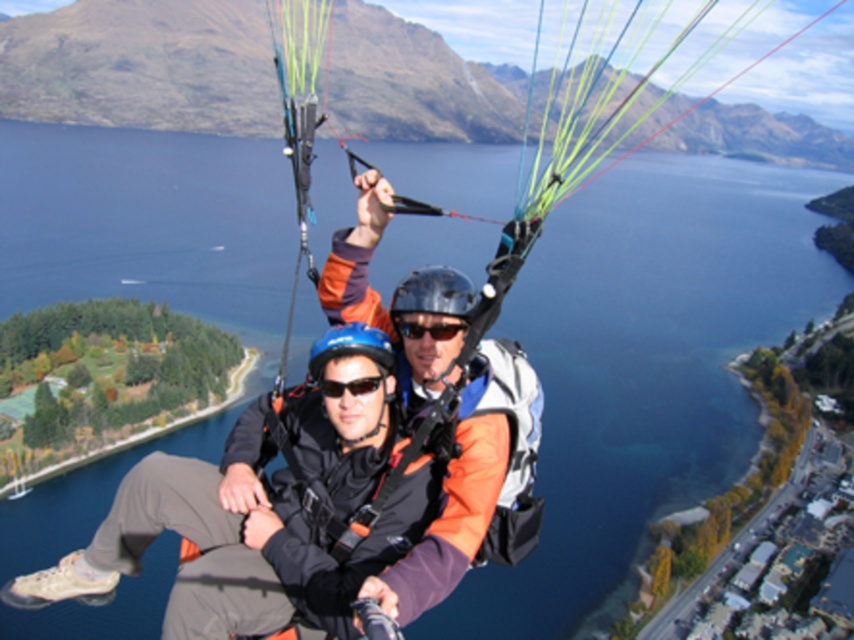
Measure the distance from orange fabric jacket at center to black matte goggles at center.

They are 7.16 meters apart.

Does orange fabric jacket at center appear over black matte goggles at center?

Incorrect, orange fabric jacket at center is not positioned above black matte goggles at center.

Is point (342, 483) farther from viewer compared to point (418, 332)?

No.

Find the location of a particular element. This screenshot has width=854, height=640. orange fabric jacket at center is located at coordinates (264, 509).

Who is positioned more to the left, black matte goggles at center or black matte sunglasses at center?

Positioned to the left is black matte sunglasses at center.

Which is above, black matte goggles at center or black matte sunglasses at center?

black matte goggles at center

Is point (449, 324) in front of point (322, 392)?

No, (449, 324) is behind (322, 392).

Locate an element on the screen. black matte goggles at center is located at coordinates (428, 326).

Does orange fabric jacket at center have a larger size compared to black matte sunglasses at center?

Indeed, orange fabric jacket at center has a larger size compared to black matte sunglasses at center.

Based on the photo, does orange fabric jacket at center appear under black matte sunglasses at center?

Yes, orange fabric jacket at center is below black matte sunglasses at center.

This screenshot has width=854, height=640. In order to click on orange fabric jacket at center in this screenshot , I will do `click(264, 509)`.